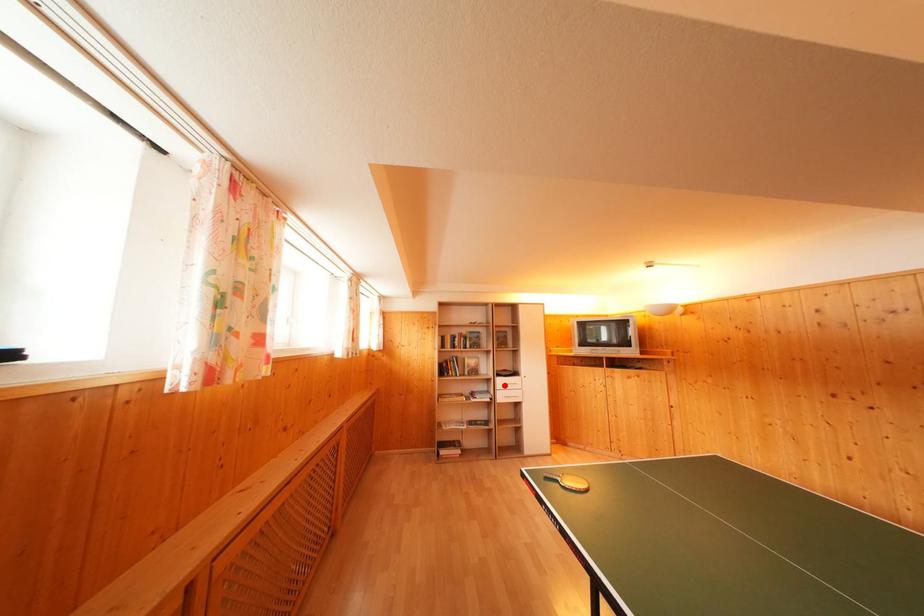
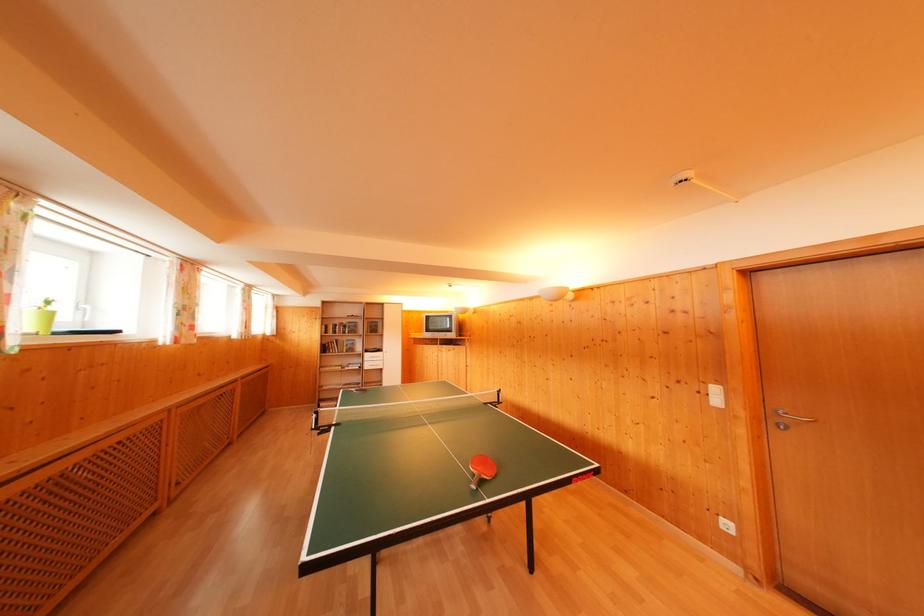
The point at the highlighted location is marked in the first image. Where is the corresponding point in the second image?

(371, 360)